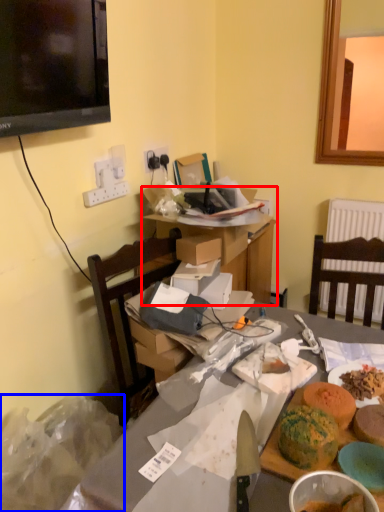
Question: Which object appears farthest to the camera in this image, table (highlighted by a red box) or waste (highlighted by a blue box)?

Choices:
 (A) table
 (B) waste

Answer: (A)